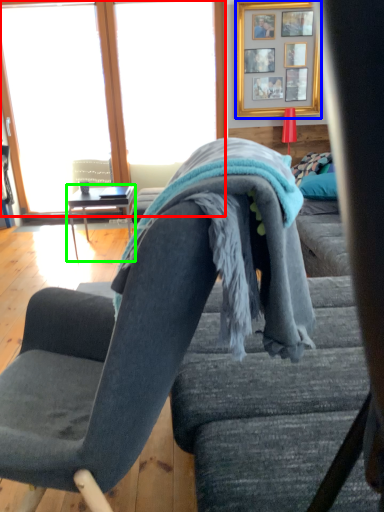
Question: Which is farther away from window (highlighted by a red box)? picture frame (highlighted by a blue box) or table (highlighted by a green box)?

Choices:
 (A) picture frame
 (B) table

Answer: (A)